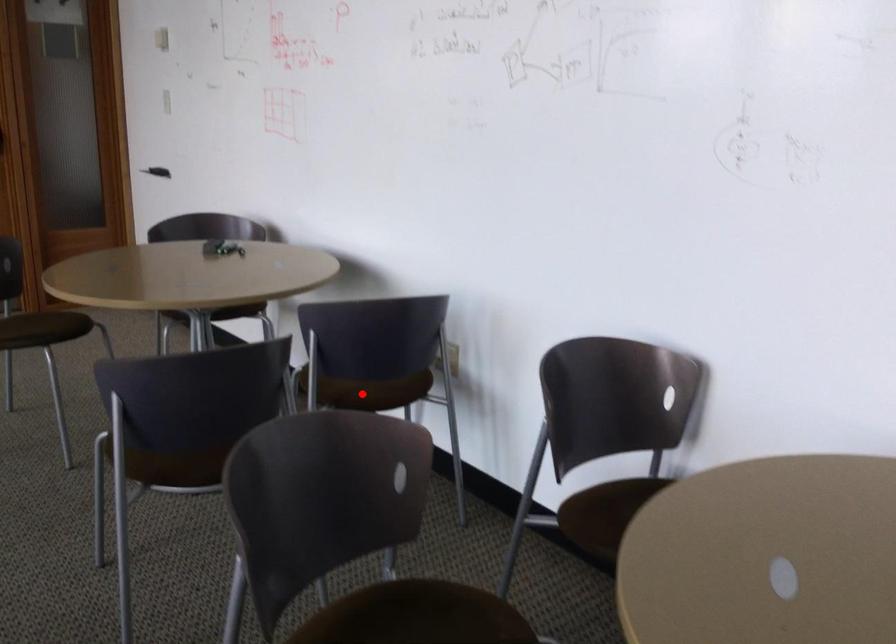
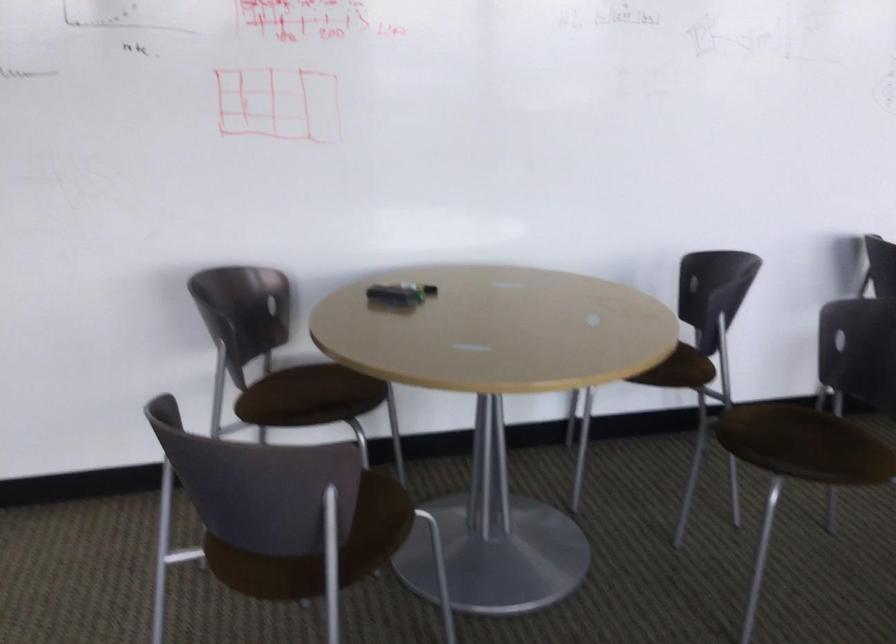
Locate, in the second image, the point that corresponds to the highlighted location in the first image.

(690, 368)